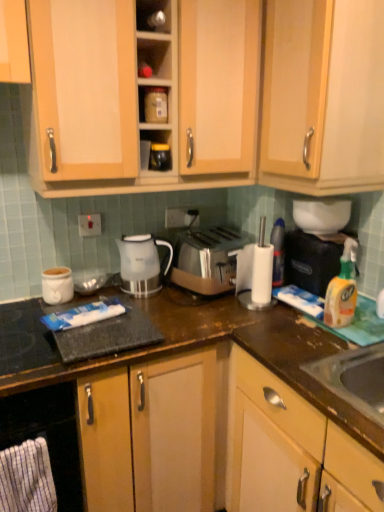
The image size is (384, 512). In order to click on free location in front of white glossy jar at left, which is counted as the fourth appliance, starting from the right in this screenshot , I will do `click(23, 320)`.